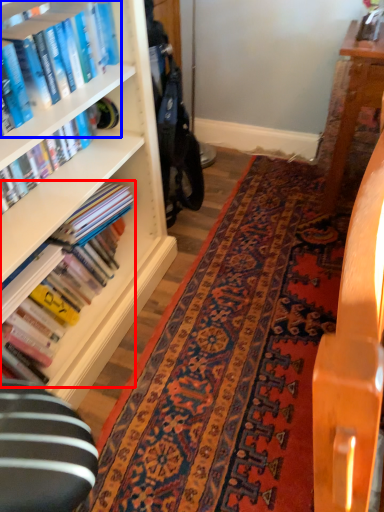
Question: Which object is closer to the camera taking this photo, book (highlighted by a red box) or book (highlighted by a blue box)?

Choices:
 (A) book
 (B) book

Answer: (B)